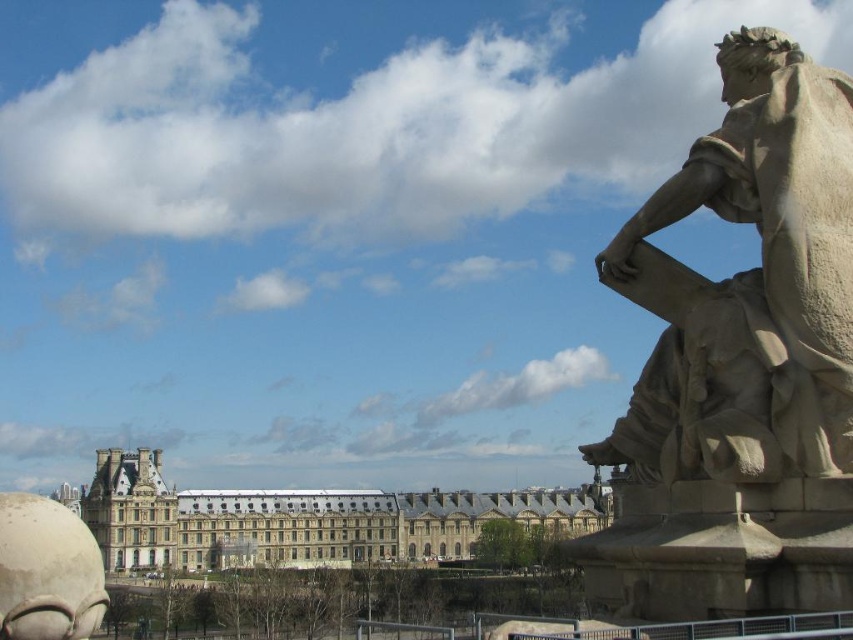
Is smooth stone statue at right smaller than stone building at center?

Indeed, smooth stone statue at right has a smaller size compared to stone building at center.

The height and width of the screenshot is (640, 853). Describe the element at coordinates (753, 285) in the screenshot. I see `smooth stone statue at right` at that location.

At what (x,y) coordinates should I click in order to perform the action: click on smooth stone statue at right. Please return your answer as a coordinate pair (x, y). The width and height of the screenshot is (853, 640). Looking at the image, I should click on tap(753, 285).